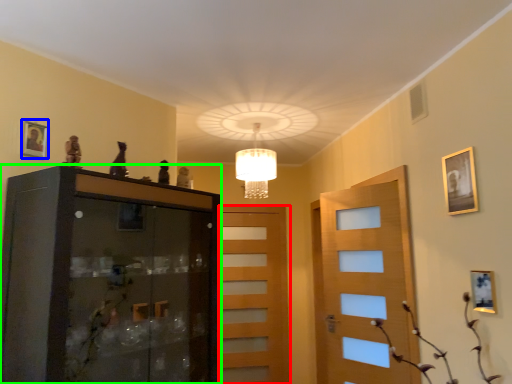
Question: Which object is the farthest from door (highlighted by a red box)? Choose among these: picture frame (highlighted by a blue box) or cabinetry (highlighted by a green box).

Choices:
 (A) picture frame
 (B) cabinetry

Answer: (A)